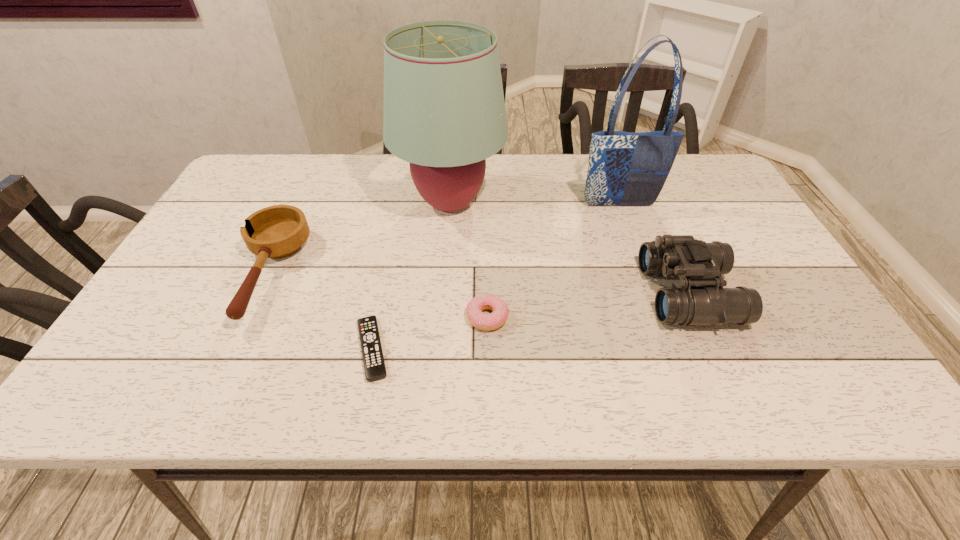
Where is `free space between the third tallest object and the lampshade`? free space between the third tallest object and the lampshade is located at coordinates (569, 248).

At what (x,y) coordinates should I click in order to perform the action: click on empty location between the binoculars and the leftmost object. Please return your answer as a coordinate pair (x, y). Looking at the image, I should click on (479, 284).

Where is `vacant space that is in between the third shortest object and the shortest object`? The height and width of the screenshot is (540, 960). vacant space that is in between the third shortest object and the shortest object is located at coordinates (321, 311).

Identify which object is the third nearest to the third shortest object. Please provide its 2D coordinates. Your answer should be formatted as a tuple, i.e. [(x, y)], where the tuple contains the x and y coordinates of a point satisfying the conditions above.

[(478, 319)]

Point out which object is positioned as the fifth nearest to the remote control. Please provide its 2D coordinates. Your answer should be formatted as a tuple, i.e. [(x, y)], where the tuple contains the x and y coordinates of a point satisfying the conditions above.

[(625, 168)]

Identify the location of free point that satisfies the following two spatial constraints: 1. with the handle on the side of the fifth tallest object; 2. on the right side of the fourth tallest object. Image resolution: width=960 pixels, height=540 pixels. (249, 318).

Image resolution: width=960 pixels, height=540 pixels. Identify the location of vacant space that satisfies the following two spatial constraints: 1. with the handle on the side of the leftmost object; 2. on the left side of the fifth tallest object. (249, 318).

Identify the location of free space that satisfies the following two spatial constraints: 1. with the handle on the side of the third shortest object; 2. on the right side of the second shortest object. The height and width of the screenshot is (540, 960). (249, 318).

Find the location of `vacant region that satisfies the following two spatial constraints: 1. on the front side of the fifth tallest object; 2. on the left side of the lampshade`. vacant region that satisfies the following two spatial constraints: 1. on the front side of the fifth tallest object; 2. on the left side of the lampshade is located at coordinates (442, 318).

Image resolution: width=960 pixels, height=540 pixels. In order to click on blank space that satisfies the following two spatial constraints: 1. with the handle on the side of the remote control; 2. on the right side of the leftmost object in this screenshot , I will do `click(234, 349)`.